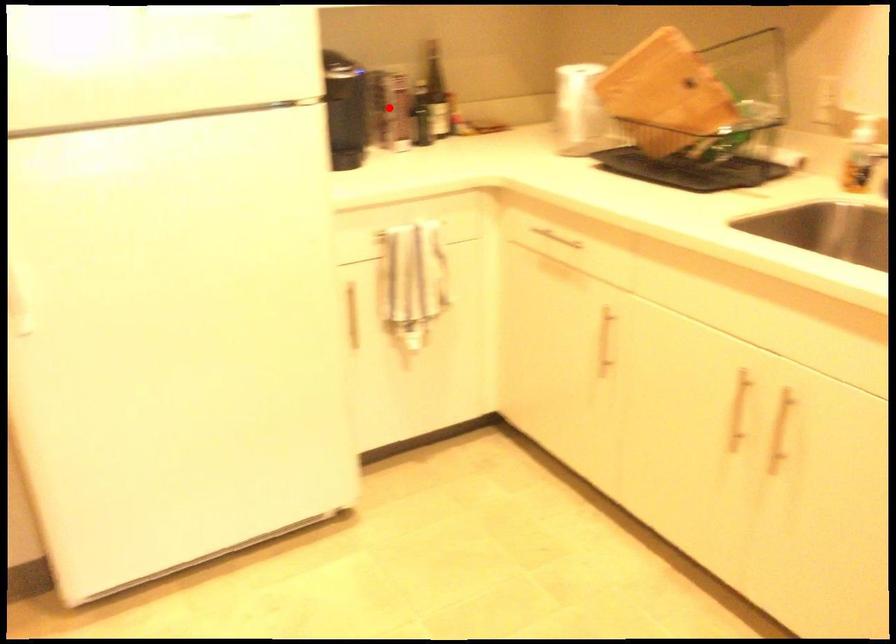
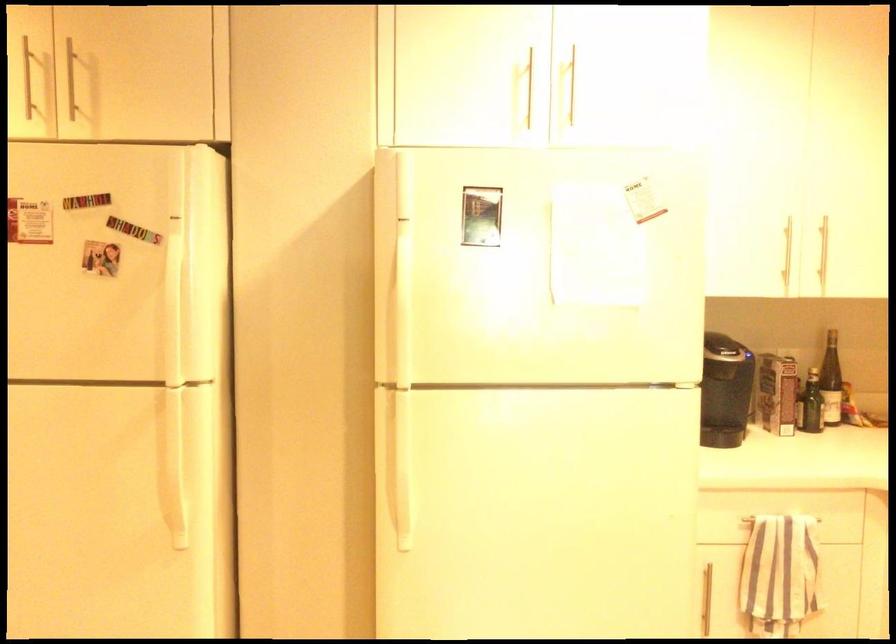
Where in the second image is the point corresponding to the highlighted location from the first image?

(777, 393)